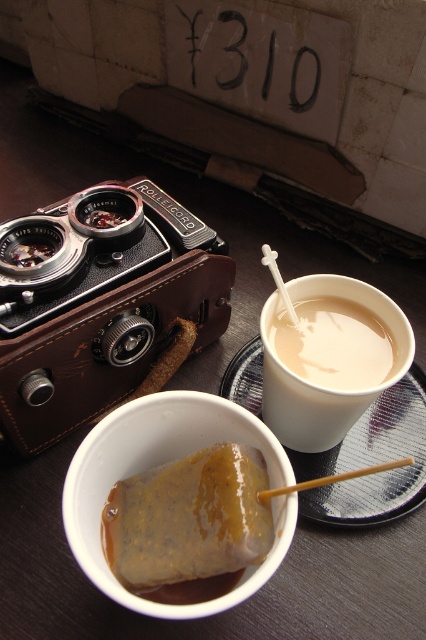
Does white matte cup at upper right lie behind matte plastic cup at upper right?

That is False.

Does white matte cup at upper right have a lesser height compared to matte plastic cup at upper right?

In fact, white matte cup at upper right may be taller than matte plastic cup at upper right.

Locate an element on the screen. This screenshot has width=426, height=640. white matte cup at upper right is located at coordinates (322, 384).

Is matte black camera at upper left shorter than white matte cup at upper right?

Incorrect, matte black camera at upper left's height does not fall short of white matte cup at upper right's.

Is matte black camera at upper left taller than white matte cup at upper right?

Correct, matte black camera at upper left is much taller as white matte cup at upper right.

Identify the location of matte black camera at upper left. Image resolution: width=426 pixels, height=640 pixels. (98, 301).

I want to click on matte black camera at upper left, so click(x=98, y=301).

Who is lower down, matte black camera at upper left or brown wooden chopstick at upper center?

brown wooden chopstick at upper center is lower down.

Can you confirm if matte black camera at upper left is positioned to the right of brown wooden chopstick at upper center?

Incorrect, matte black camera at upper left is not on the right side of brown wooden chopstick at upper center.

At what (x,y) coordinates should I click in order to perform the action: click on matte black camera at upper left. Please return your answer as a coordinate pair (x, y). Looking at the image, I should click on (98, 301).